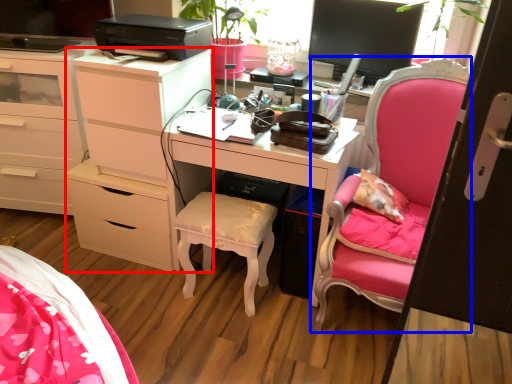
Question: Which point is closer to the camera, chest of drawers (highlighted by a red box) or chair (highlighted by a blue box)?

Choices:
 (A) chest of drawers
 (B) chair

Answer: (B)